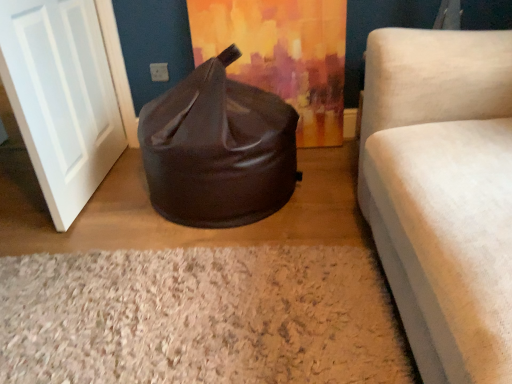
Question: Does brown leather bean bag at center have a smaller size compared to white shaggy rug at lower center?

Choices:
 (A) yes
 (B) no

Answer: (B)

Question: Is brown leather bean bag at center bigger than white shaggy rug at lower center?

Choices:
 (A) yes
 (B) no

Answer: (A)

Question: Is brown leather bean bag at center looking in the opposite direction of white shaggy rug at lower center?

Choices:
 (A) no
 (B) yes

Answer: (A)

Question: Is brown leather bean bag at center in front of white shaggy rug at lower center?

Choices:
 (A) no
 (B) yes

Answer: (A)

Question: Does brown leather bean bag at center appear on the right side of white shaggy rug at lower center?

Choices:
 (A) no
 (B) yes

Answer: (B)

Question: Is brown leather bean bag at center with white shaggy rug at lower center?

Choices:
 (A) yes
 (B) no

Answer: (B)

Question: From a real-world perspective, is white matte door at left physically above white shaggy rug at lower center?

Choices:
 (A) yes
 (B) no

Answer: (A)

Question: Considering the relative sizes of white matte door at left and white shaggy rug at lower center in the image provided, is white matte door at left taller than white shaggy rug at lower center?

Choices:
 (A) no
 (B) yes

Answer: (B)

Question: Are white matte door at left and white shaggy rug at lower center located far from each other?

Choices:
 (A) yes
 (B) no

Answer: (B)

Question: Can you confirm if white matte door at left is shorter than white shaggy rug at lower center?

Choices:
 (A) yes
 (B) no

Answer: (B)

Question: Is white matte door at left oriented towards white shaggy rug at lower center?

Choices:
 (A) yes
 (B) no

Answer: (B)

Question: Is white shaggy rug at lower center a part of white matte door at left?

Choices:
 (A) yes
 (B) no

Answer: (B)

Question: Is white matte door at left far away from brown leather bean bag at center?

Choices:
 (A) no
 (B) yes

Answer: (A)